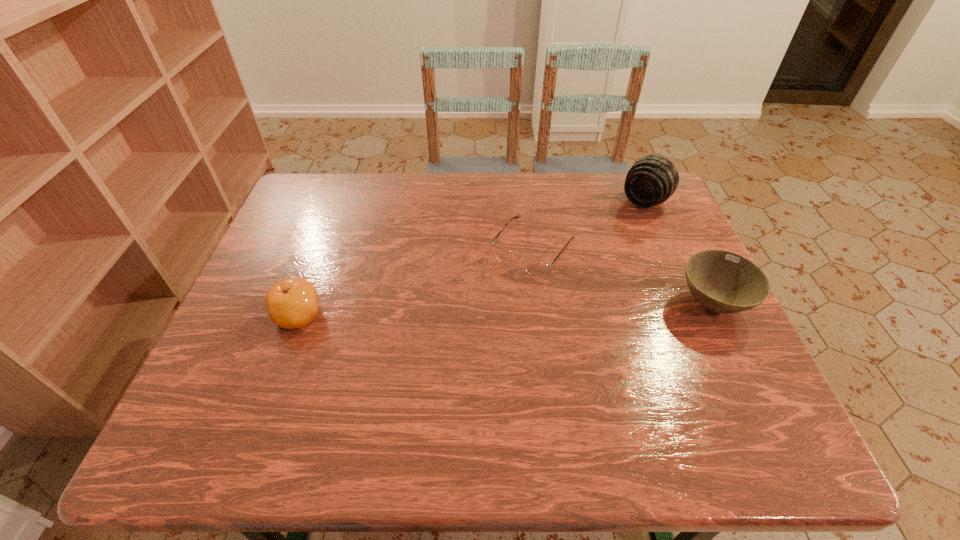
I want to click on free spot on the desktop that is between the clementine and the bowl and is positioned on the front-facing side of the spectacles, so click(x=488, y=310).

Where is `vacant space on the desktop that is between the clementine and the bowl and is positioned at the front element of the farthest object`? The height and width of the screenshot is (540, 960). vacant space on the desktop that is between the clementine and the bowl and is positioned at the front element of the farthest object is located at coordinates (551, 308).